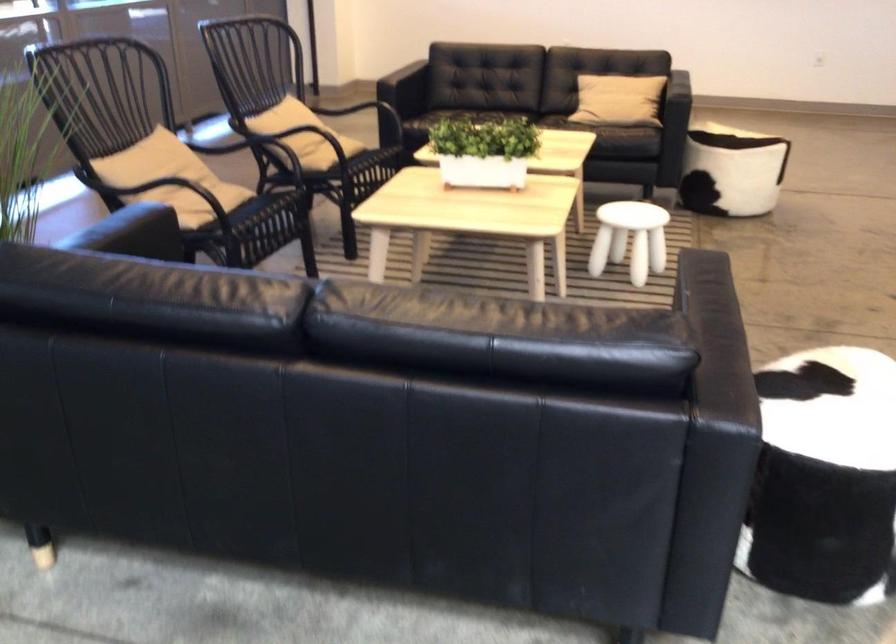
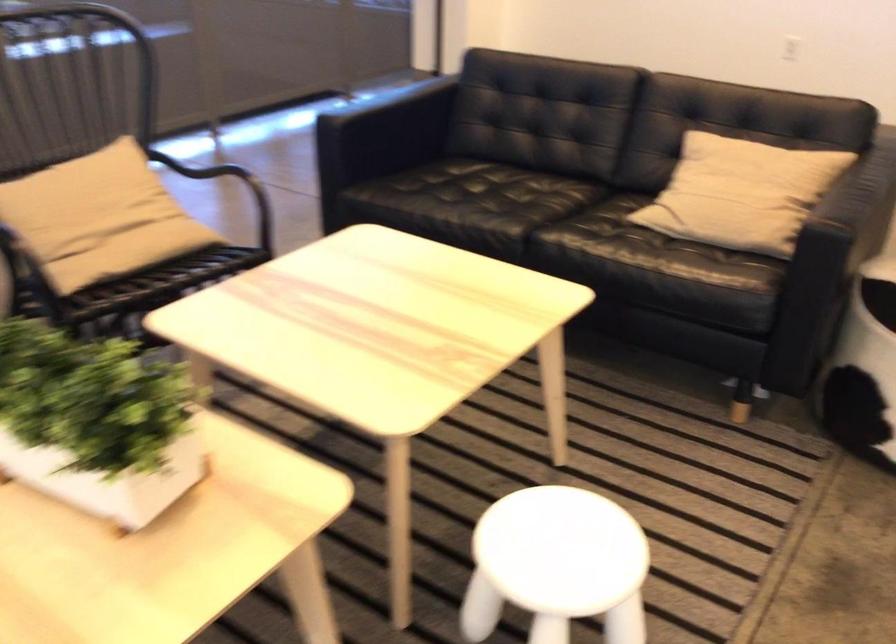
In the scene shown: In a continuous first-person perspective shot, in which direction is the camera moving?

The cameraman walked toward right, forward.